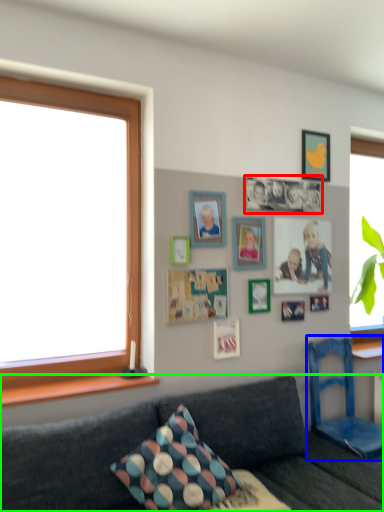
Question: Which object is the farthest from decorative picture (highlighted by a red box)? Choose among these: armchair (highlighted by a blue box) or studio couch (highlighted by a green box).

Choices:
 (A) armchair
 (B) studio couch

Answer: (B)